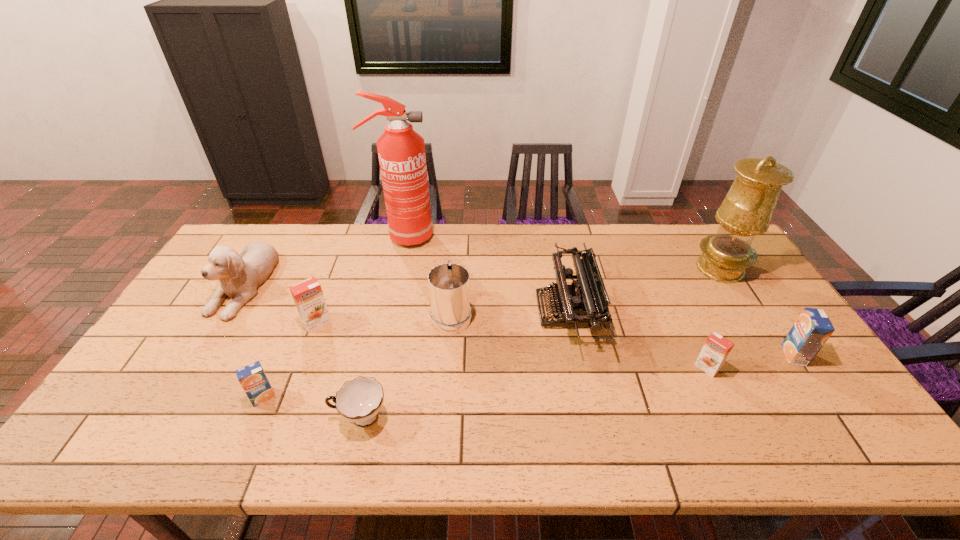
At what (x,y) coordinates should I click in order to perform the action: click on the farther blue orange_juice. Please return your answer as a coordinate pair (x, y). Looking at the image, I should click on (812, 329).

Find the location of `typewriter`. typewriter is located at coordinates (584, 302).

Find the location of a particular element. This screenshot has width=960, height=540. the third object from right to left is located at coordinates (716, 349).

This screenshot has height=540, width=960. In order to click on the third orange_juice from left to right in this screenshot , I will do `click(716, 349)`.

Where is `the smaller blue orange_juice`? This screenshot has width=960, height=540. the smaller blue orange_juice is located at coordinates (252, 377).

The image size is (960, 540). I want to click on the left blue orange_juice, so click(252, 377).

Where is `white cup`? The image size is (960, 540). white cup is located at coordinates (359, 401).

Locate an element on the screen. Image resolution: width=960 pixels, height=540 pixels. the shortest object is located at coordinates (359, 401).

The image size is (960, 540). Find the location of `free space located 0.160m at the nozzle of the red fire extinguisher`. free space located 0.160m at the nozzle of the red fire extinguisher is located at coordinates point(477,237).

I want to click on vacant space situated on the left of the ninth shortest object, so click(x=637, y=268).